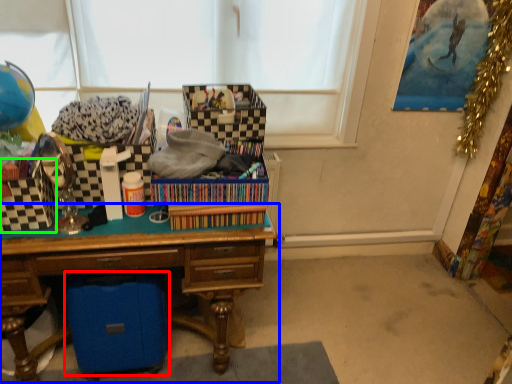
Question: Estimate the real-world distances between objects in this image. Which object is closer to storage box (highlighted by a red box), desk (highlighted by a blue box) or storage box (highlighted by a green box)?

Choices:
 (A) desk
 (B) storage box

Answer: (A)